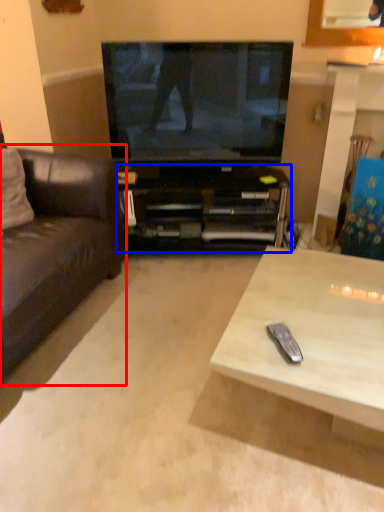
Question: Among these objects, which one is nearest to the camera, studio couch (highlighted by a red box) or cabinetry (highlighted by a blue box)?

Choices:
 (A) studio couch
 (B) cabinetry

Answer: (A)